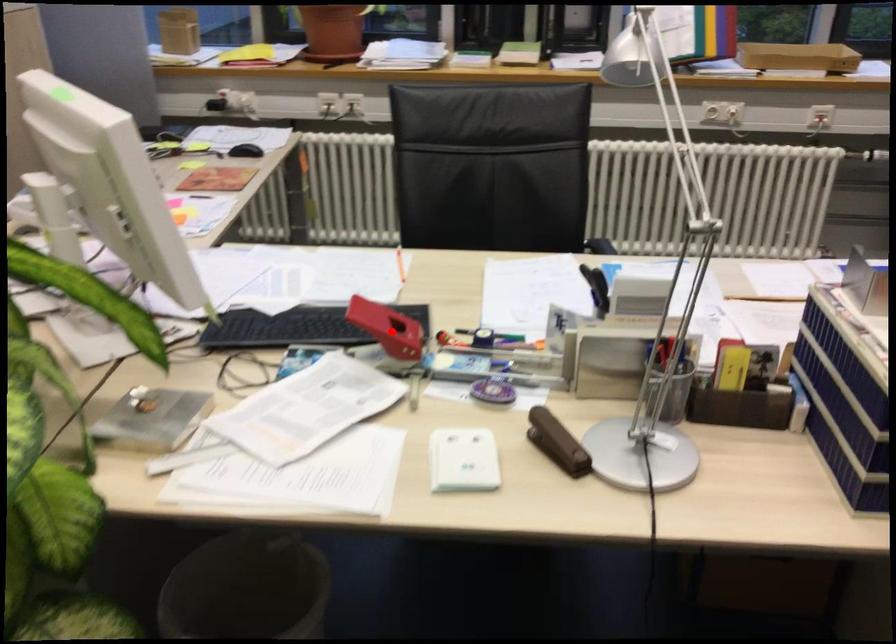
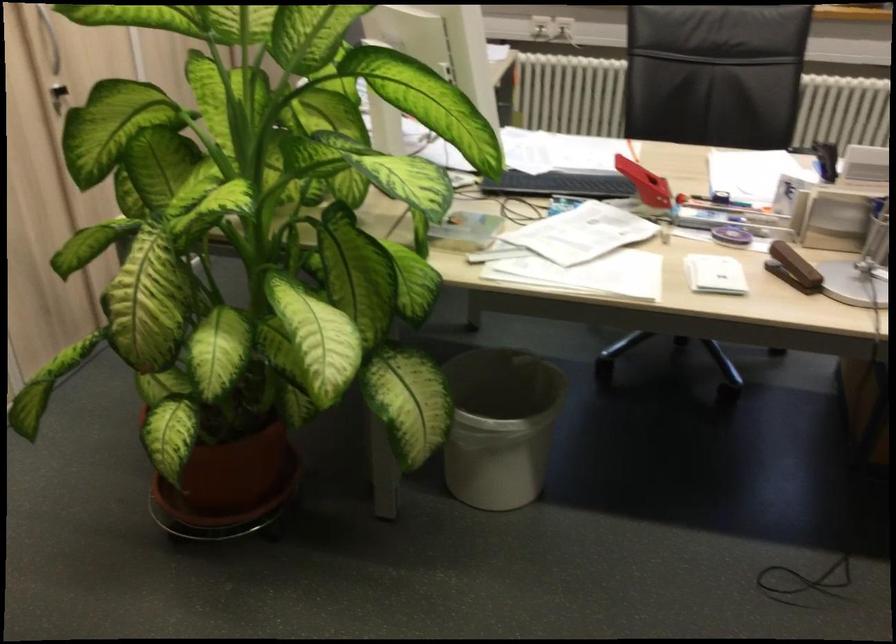
Find the pixel in the second image that matches the highlighted location in the first image.

(644, 183)